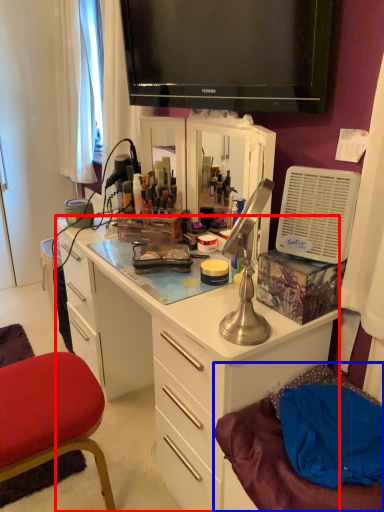
Question: Which object appears farthest to the camera in this image, desk (highlighted by a red box) or wide (highlighted by a blue box)?

Choices:
 (A) desk
 (B) wide

Answer: (A)